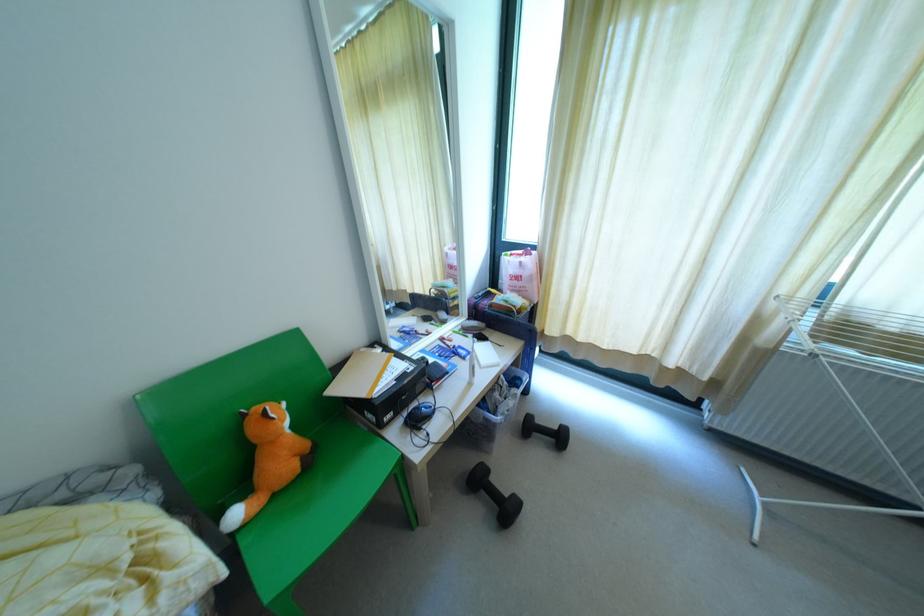
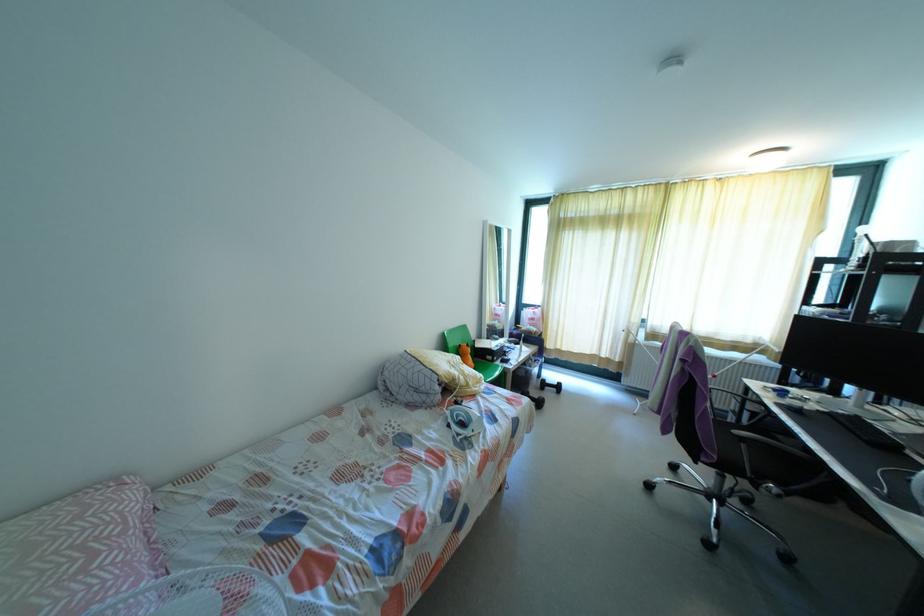
Find the pixel in the second image that matches point 493,493 in the first image.

(531, 399)